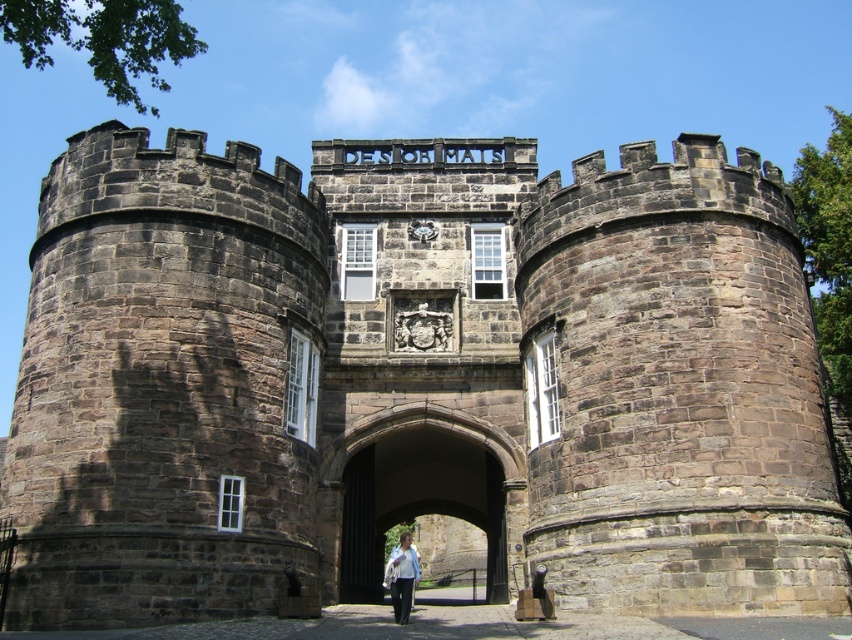
You are standing in front of the historic stone structure and notice a white cotton shirt at center. Can you walk through the dark stone archway at center without stepping on the shirt?

The dark stone archway at center is above the white cotton shirt at center, so you can walk through the dark stone archway at center without stepping on the shirt as they are at different heights.